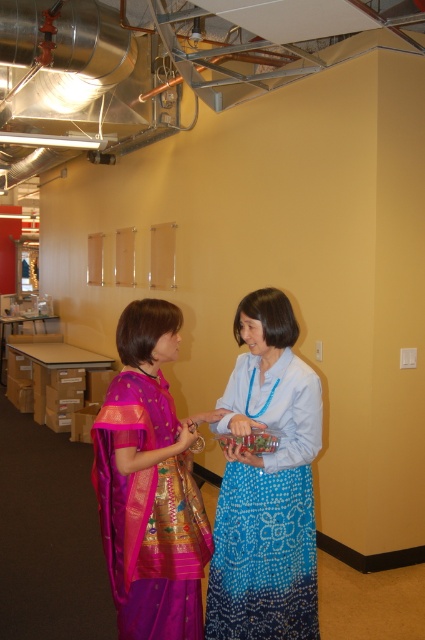
Question: Can you confirm if blue beaded skirt at center is thinner than purple silk saree at center?

Choices:
 (A) yes
 (B) no

Answer: (A)

Question: Is blue beaded skirt at center positioned in front of purple silk saree at center?

Choices:
 (A) yes
 (B) no

Answer: (B)

Question: Does blue beaded skirt at center appear on the left side of purple silk saree at center?

Choices:
 (A) no
 (B) yes

Answer: (A)

Question: Which object appears closest to the camera in this image?

Choices:
 (A) purple silk saree at center
 (B) blue beaded skirt at center

Answer: (A)